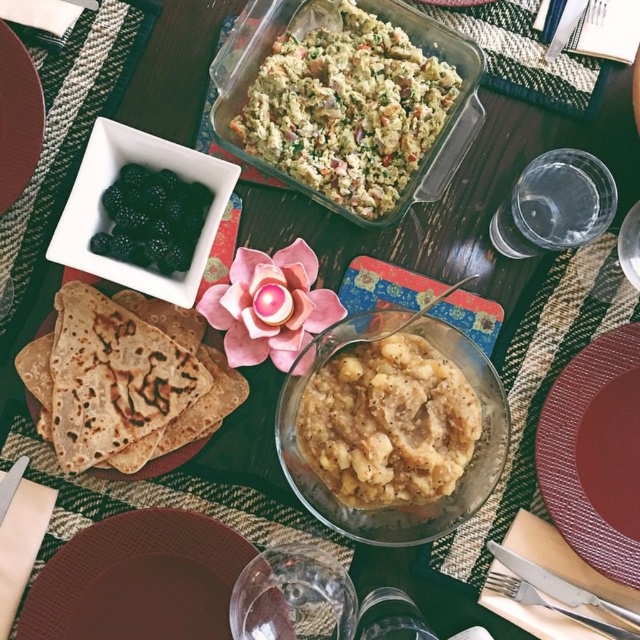
Is smooth brown mashed potatoes at center above brown matte platter at upper left?

No.

Which is more to the left, smooth brown mashed potatoes at center or brown matte platter at upper left?

brown matte platter at upper left

Is point (380, 342) more distant than point (26, 113)?

No, it is not.

Where is `smooth brown mashed potatoes at center`? The image size is (640, 640). smooth brown mashed potatoes at center is located at coordinates (388, 422).

Can you confirm if brown/crumbly flatbread at lower left is bigger than maroon plastic plate at lower right?

Yes, brown/crumbly flatbread at lower left is bigger than maroon plastic plate at lower right.

Between point (29, 365) and point (557, 394), which one is positioned in front?

Point (29, 365) is in front.

Who is more distant from viewer, (108, 410) or (554, 500)?

Positioned behind is point (554, 500).

This screenshot has width=640, height=640. Find the location of `brown/crumbly flatbread at lower left`. brown/crumbly flatbread at lower left is located at coordinates click(124, 380).

Can you confirm if green crumbly mixture at center is positioned to the left of brown matte plate at lower left?

In fact, green crumbly mixture at center is to the right of brown matte plate at lower left.

Consider the image. Is green crumbly mixture at center further to camera compared to brown matte plate at lower left?

Yes, green crumbly mixture at center is further from the viewer.

Describe the element at coordinates (348, 112) in the screenshot. I see `green crumbly mixture at center` at that location.

What are the coordinates of `green crumbly mixture at center` in the screenshot? It's located at (348, 112).